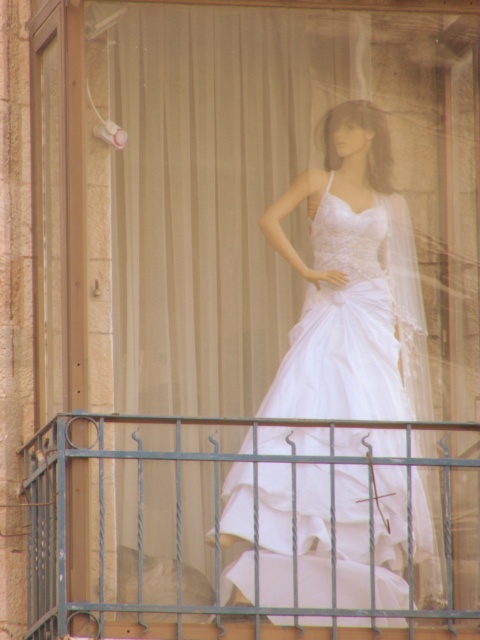
Looking at this image, you are a customer looking at the display through the window. Can you see the entire metallic wrought iron railing at lower center without moving your head, given that the white satin dress at center is blocking part of your view?

The white satin dress at center is taller than the metallic wrought iron railing at lower center, so the dress may block the view of the railing depending on your angle. However, since the railing is at lower center and the dress is also at center, you might still see parts of the railing around or below the dress.

You are a photographer standing at the entrance of a store and want to take a clear photo of the white satin dress at center. The store has a rule that you must stay behind the metal railing in front of the display. Given that the metal railing is 10 feet away from you, can you capture the dress in focus without moving closer than the railing?

The white satin dress at center is 205.11 feet away from the camera. Since the metal railing is only 10 feet away from you, the distance between you and the dress is still 205.11 feet. Most cameras can focus on subjects at that distance as long as there is no obstruction. Therefore, you can capture the white satin dress at center in focus without moving closer than the railing.

You are a store employee who needs to ensure the white satin dress at center is visible through the metallic wrought iron railing at lower center. Based on their sizes, can the dress be seen clearly from the front?

The white satin dress at center is larger in size than the metallic wrought iron railing at lower center, so yes, the dress can be seen clearly from the front as it is bigger than the railing.